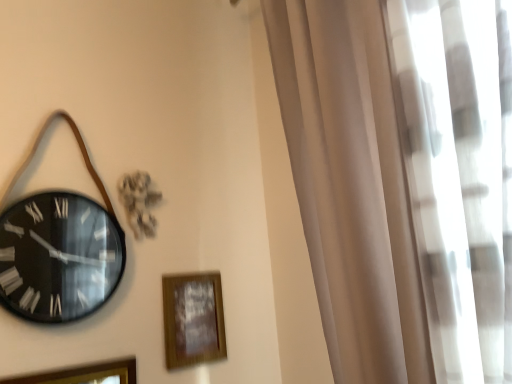
This screenshot has height=384, width=512. What do you see at coordinates (58, 257) in the screenshot?
I see `black glass clock at left` at bounding box center [58, 257].

What are the coordinates of `black glass clock at left` in the screenshot? It's located at (58, 257).

In terms of height, does black glass clock at left look taller or shorter compared to white sheer curtain at right?

Considering their sizes, black glass clock at left has less height than white sheer curtain at right.

Is there a large distance between black glass clock at left and white sheer curtain at right?

No, black glass clock at left is not far away from white sheer curtain at right.

Which of these two, black glass clock at left or white sheer curtain at right, is wider?

Wider between the two is white sheer curtain at right.

Is black glass clock at left smaller than white sheer curtain at right?

Indeed, black glass clock at left has a smaller size compared to white sheer curtain at right.

From the picture: Do you think wooden picture frame at lower left, the second picture frame positioned from the back, is within white sheer curtain at right, or outside of it?

The correct answer is: outside.

In terms of height, does wooden picture frame at lower left, acting as the 1th picture frame starting from the left, look taller or shorter compared to white sheer curtain at right?

wooden picture frame at lower left, acting as the 1th picture frame starting from the left, is shorter than white sheer curtain at right.

Based on their positions, is wooden picture frame at lower left, which ranks as the second picture frame in right-to-left order, located to the left or right of white sheer curtain at right?

wooden picture frame at lower left, which ranks as the second picture frame in right-to-left order, is positioned on white sheer curtain at right's left side.

From the image's perspective, which one is positioned lower, wooden picture frame at lower left, acting as the 1th picture frame starting from the left, or white sheer curtain at right?

From the image's view, wooden picture frame at lower left, acting as the 1th picture frame starting from the left, is below.

Is point (410, 379) farther from viewer compared to point (174, 335)?

No, it is not.

Between white sheer curtain at right and wooden picture frame at lower center, arranged as the first picture frame when viewed from the right, which one has less height?

wooden picture frame at lower center, arranged as the first picture frame when viewed from the right, is shorter.

From a real-world perspective, which is physically above, white sheer curtain at right or wooden picture frame at lower center, which appears as the 2th picture frame when viewed from the left?

In real-world perspective, white sheer curtain at right is above.

Is white sheer curtain at right outside of wooden picture frame at lower center, arranged as the first picture frame when viewed from the right?

Yes, white sheer curtain at right is not within wooden picture frame at lower center, arranged as the first picture frame when viewed from the right.

Is wooden picture frame at lower left, acting as the first picture frame starting from the front, oriented towards black glass clock at left?

No.

From the image's perspective, which is above, wooden picture frame at lower left, acting as the 1th picture frame starting from the left, or black glass clock at left?

From the image's view, black glass clock at left is above.

From a real-world perspective, between wooden picture frame at lower left, the second picture frame positioned from the back, and black glass clock at left, who is vertically higher?

black glass clock at left is physically above.

Between wooden picture frame at lower left, the second picture frame positioned from the back, and black glass clock at left, which one has smaller size?

wooden picture frame at lower left, the second picture frame positioned from the back, is smaller.

Is point (204, 298) farther from viewer compared to point (57, 233)?

Yes, point (204, 298) is farther from viewer.

Looking at the image, does wooden picture frame at lower center, arranged as the first picture frame when viewed from the right, seem bigger or smaller compared to black glass clock at left?

Considering their sizes, wooden picture frame at lower center, arranged as the first picture frame when viewed from the right, takes up less space than black glass clock at left.

Can you confirm if wooden picture frame at lower center, arranged as the first picture frame when viewed from the right, is shorter than black glass clock at left?

Yes.

Could you measure the distance between wooden picture frame at lower center, arranged as the first picture frame when viewed from the right, and black glass clock at left?

wooden picture frame at lower center, arranged as the first picture frame when viewed from the right, and black glass clock at left are 11.25 inches apart.

Considering the sizes of wooden picture frame at lower center, marked as the first picture frame in a back-to-front arrangement, and wooden picture frame at lower left, the second picture frame positioned from the back, in the image, is wooden picture frame at lower center, marked as the first picture frame in a back-to-front arrangement, wider or thinner than wooden picture frame at lower left, the second picture frame positioned from the back,?

wooden picture frame at lower center, marked as the first picture frame in a back-to-front arrangement, is wider than wooden picture frame at lower left, the second picture frame positioned from the back.

From a real-world perspective, which object rests below the other?

wooden picture frame at lower left, which ranks as the second picture frame in right-to-left order, from a real-world perspective.

Which is behind, point (173, 279) or point (103, 381)?

The point (173, 279) is farther from the camera.

How distant is wooden picture frame at lower center, which appears as the 2th picture frame when viewed from the left, from wooden picture frame at lower left, acting as the first picture frame starting from the front?

8.52 inches.

Is black glass clock at left with wooden picture frame at lower left, the second picture frame positioned from the back?

No, black glass clock at left is not next to wooden picture frame at lower left, the second picture frame positioned from the back.

From the image's perspective, is black glass clock at left beneath wooden picture frame at lower left, which ranks as the second picture frame in right-to-left order?

No, from the image's perspective, black glass clock at left is not beneath wooden picture frame at lower left, which ranks as the second picture frame in right-to-left order.

From a real-world perspective, is black glass clock at left physically below wooden picture frame at lower left, acting as the 1th picture frame starting from the left?

No.

Is black glass clock at left looking in the opposite direction of wooden picture frame at lower left, acting as the 1th picture frame starting from the left?

That's not correct — black glass clock at left is not looking away from wooden picture frame at lower left, acting as the 1th picture frame starting from the left.

Locate an element on the screen. The width and height of the screenshot is (512, 384). wall clock behind the white sheer curtain at right is located at coordinates (58, 257).

Identify the location of curtain that appears above the wooden picture frame at lower left, acting as the 1th picture frame starting from the left (from the image's perspective). This screenshot has height=384, width=512. (403, 180).

Estimate the real-world distances between objects in this image. Which object is closer to wooden picture frame at lower left, acting as the first picture frame starting from the front, black glass clock at left or white sheer curtain at right?

Based on the image, black glass clock at left appears to be nearer to wooden picture frame at lower left, acting as the first picture frame starting from the front.

Estimate the real-world distances between objects in this image. Which object is closer to wooden picture frame at lower center, marked as the first picture frame in a back-to-front arrangement, wooden picture frame at lower left, which ranks as the second picture frame in right-to-left order, or white sheer curtain at right?

wooden picture frame at lower left, which ranks as the second picture frame in right-to-left order, lies closer to wooden picture frame at lower center, marked as the first picture frame in a back-to-front arrangement, than the other object.

Considering their positions, is black glass clock at left positioned further to wooden picture frame at lower center, which appears as the 2th picture frame when viewed from the left, than wooden picture frame at lower left, the second picture frame positioned from the back?

black glass clock at left lies further to wooden picture frame at lower center, which appears as the 2th picture frame when viewed from the left, than the other object.

Estimate the real-world distances between objects in this image. Which object is further from wooden picture frame at lower center, arranged as the first picture frame when viewed from the right, white sheer curtain at right or black glass clock at left?

Based on the image, white sheer curtain at right appears to be further to wooden picture frame at lower center, arranged as the first picture frame when viewed from the right.

From the image, which object appears to be farther from black glass clock at left, white sheer curtain at right or wooden picture frame at lower left, which ranks as the second picture frame in right-to-left order?

Among the two, white sheer curtain at right is located further to black glass clock at left.

Estimate the real-world distances between objects in this image. Which object is closer to wooden picture frame at lower center, which appears as the 2th picture frame when viewed from the left, black glass clock at left or white sheer curtain at right?

Among the two, black glass clock at left is located nearer to wooden picture frame at lower center, which appears as the 2th picture frame when viewed from the left.

From the image, which object appears to be nearer to black glass clock at left, wooden picture frame at lower left, acting as the first picture frame starting from the front, or white sheer curtain at right?

wooden picture frame at lower left, acting as the first picture frame starting from the front, lies closer to black glass clock at left than the other object.

Looking at this image, based on their spatial positions, is wooden picture frame at lower center, which appears as the 2th picture frame when viewed from the left, or wooden picture frame at lower left, which ranks as the second picture frame in right-to-left order, closer to white sheer curtain at right?

wooden picture frame at lower center, which appears as the 2th picture frame when viewed from the left.

The image size is (512, 384). I want to click on wall clock between white sheer curtain at right and wooden picture frame at lower center, marked as the first picture frame in a back-to-front arrangement, in the front-back direction, so click(58, 257).

In order to click on picture frame that lies between white sheer curtain at right and wooden picture frame at lower left, acting as the 1th picture frame starting from the left, from top to bottom in this screenshot , I will do `click(193, 319)`.

You are a GUI agent. You are given a task and a screenshot of the screen. Output one action in this format:
    pyautogui.click(x=<x>, y=<y>)
    Task: Click on the picture frame between black glass clock at left and wooden picture frame at lower left, acting as the 1th picture frame starting from the left, in the up-down direction
    Image resolution: width=512 pixels, height=384 pixels.
    Given the screenshot: What is the action you would take?
    pyautogui.click(x=193, y=319)